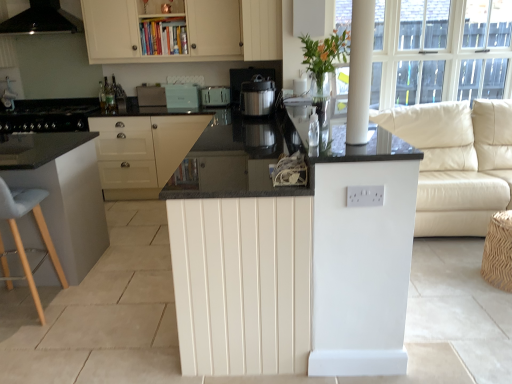
Question: Is light blue fabric stool at left, which is counted as the second bar stool, starting from the right, further to camera compared to black matte range hood at upper left?

Choices:
 (A) yes
 (B) no

Answer: (B)

Question: Is black matte range hood at upper left at the back of light blue fabric stool at left, which is counted as the second bar stool, starting from the right?

Choices:
 (A) no
 (B) yes

Answer: (A)

Question: From a real-world perspective, is light blue fabric stool at left, which is counted as the second bar stool, starting from the right, positioned under black matte range hood at upper left based on gravity?

Choices:
 (A) yes
 (B) no

Answer: (A)

Question: Can you confirm if light blue fabric stool at left, which is counted as the second bar stool, starting from the right, is smaller than black matte range hood at upper left?

Choices:
 (A) yes
 (B) no

Answer: (A)

Question: Is the surface of light blue fabric stool at left, which is the first bar stool in left-to-right order, in direct contact with black matte range hood at upper left?

Choices:
 (A) no
 (B) yes

Answer: (A)

Question: Do you think light blue fabric stool at left, which is the first bar stool in left-to-right order, is within satin silver toaster at center, which is counted as the 1th appliance, starting from the right, or outside of it?

Choices:
 (A) inside
 (B) outside

Answer: (B)

Question: Based on their positions, is light blue fabric stool at left, which is counted as the second bar stool, starting from the right, located to the left or right of satin silver toaster at center, which is counted as the 1th appliance, starting from the right?

Choices:
 (A) left
 (B) right

Answer: (A)

Question: From the image's perspective, is light blue fabric stool at left, which is the first bar stool in left-to-right order, positioned above or below satin silver toaster at center, acting as the 4th appliance starting from the left?

Choices:
 (A) above
 (B) below

Answer: (B)

Question: Is point (15, 211) positioned closer to the camera than point (204, 94)?

Choices:
 (A) farther
 (B) closer

Answer: (B)

Question: In terms of width, does brown woven stool at lower right, positioned as the 2th bar stool in left-to-right order, look wider or thinner when compared to translucent glass vase at upper center?

Choices:
 (A) wide
 (B) thin

Answer: (A)

Question: Relative to translucent glass vase at upper center, is brown woven stool at lower right, positioned as the 2th bar stool in left-to-right order, in front or behind?

Choices:
 (A) behind
 (B) front

Answer: (B)

Question: Is brown woven stool at lower right, the first bar stool viewed from the right, situated inside translucent glass vase at upper center or outside?

Choices:
 (A) outside
 (B) inside

Answer: (A)

Question: In terms of height, does brown woven stool at lower right, the first bar stool viewed from the right, look taller or shorter compared to translucent glass vase at upper center?

Choices:
 (A) tall
 (B) short

Answer: (B)

Question: From the image's perspective, relative to white glossy pillar at upper right, is brown woven stool at lower right, positioned as the 2th bar stool in left-to-right order, above or below?

Choices:
 (A) below
 (B) above

Answer: (A)

Question: Based on their sizes in the image, would you say brown woven stool at lower right, the first bar stool viewed from the right, is bigger or smaller than white glossy pillar at upper right?

Choices:
 (A) small
 (B) big

Answer: (B)